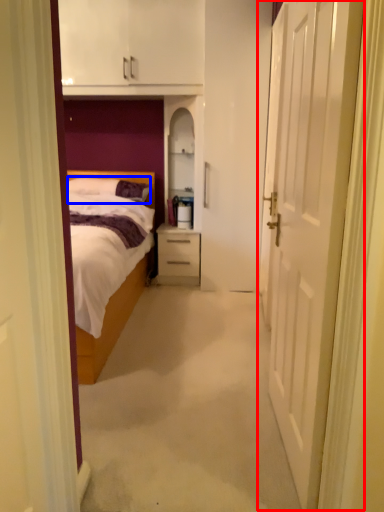
Question: Which point is closer to the camera, door (highlighted by a red box) or pillow (highlighted by a blue box)?

Choices:
 (A) door
 (B) pillow

Answer: (A)